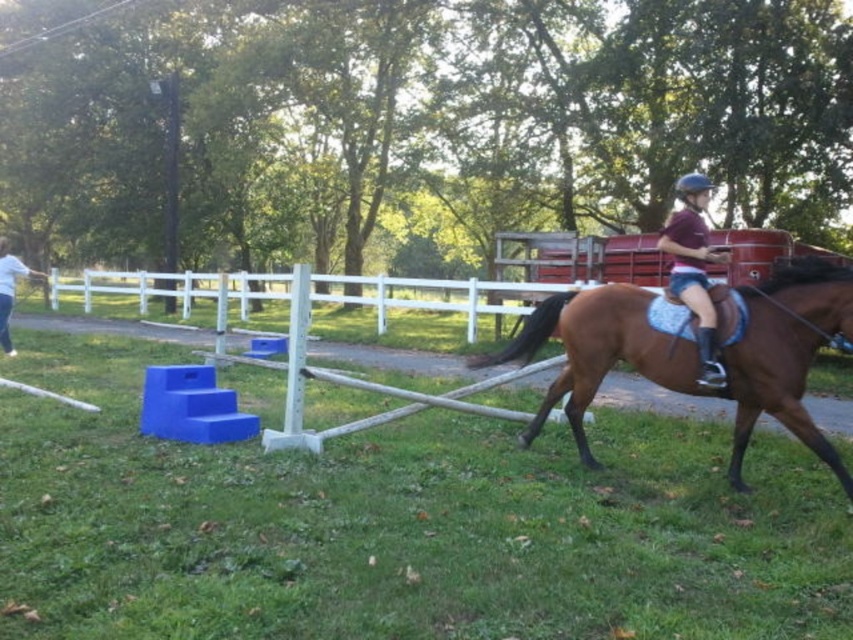
You are a photographer standing in the field and want to capture a photo of the white cotton shirt at left and the white vinyl fence at center. Since both are white, how can you distinguish which object is closer to you?

The white vinyl fence at center is positioned under the white cotton shirt at left, meaning the white cotton shirt at left is closer to you than the white vinyl fence at center.

You are a photographer trying to capture the horse and rider in the scene. You notice two points marked in the image. The first point is at coordinate point (397, 291) and the second is at point (20, 260). Which point should you focus on to ensure the subject is in sharp focus if you want the horse and rider to be clear?

You should focus on point (397, 291) because it is closer to the camera than point (20, 260), ensuring the horse and rider are in sharp focus.